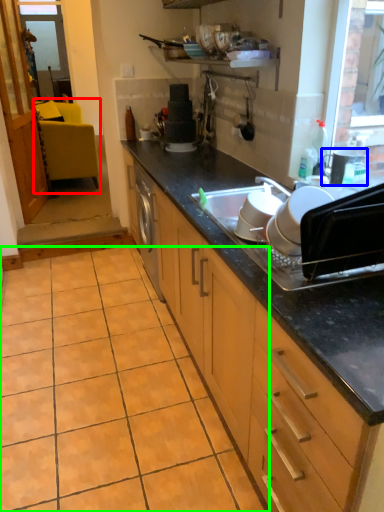
Question: Estimate the real-world distances between objects in this image. Which object is farther from chair (highlighted by a red box), appliance (highlighted by a blue box) or ceramic tile (highlighted by a green box)?

Choices:
 (A) appliance
 (B) ceramic tile

Answer: (A)